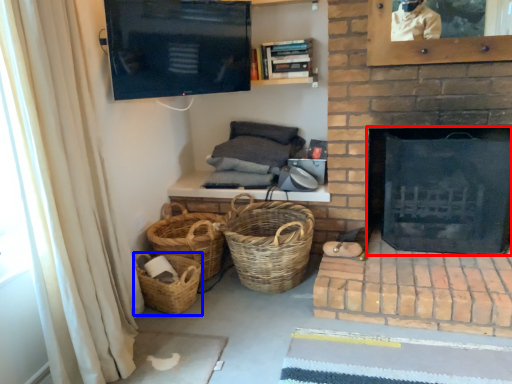
Question: Which object appears farthest to the camera in this image, fireplace (highlighted by a red box) or basket (highlighted by a blue box)?

Choices:
 (A) fireplace
 (B) basket

Answer: (B)